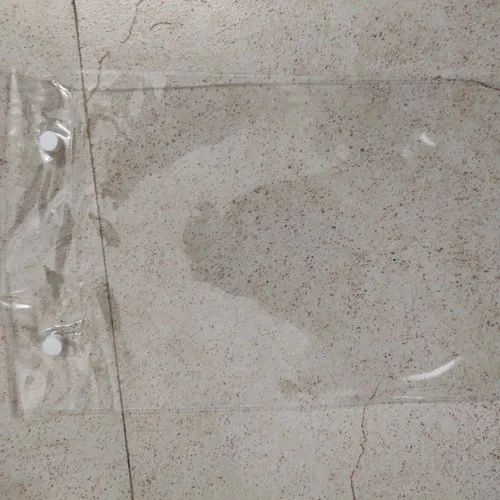
The height and width of the screenshot is (500, 500). I want to click on groutline, so click(128, 457).